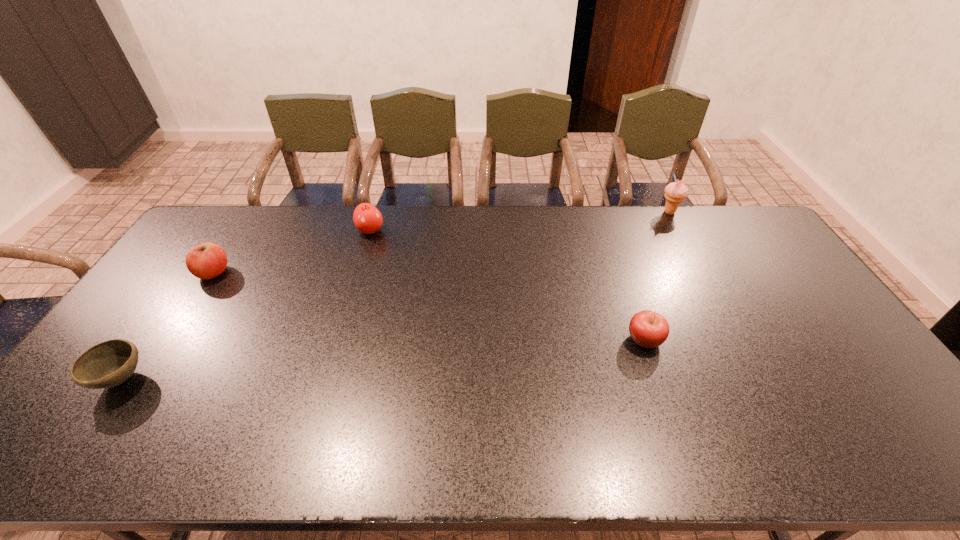
This screenshot has height=540, width=960. In order to click on the tallest object in this screenshot , I will do (676, 192).

This screenshot has width=960, height=540. I want to click on icecream, so click(676, 192).

This screenshot has height=540, width=960. Identify the location of the farthest apple. (367, 218).

Image resolution: width=960 pixels, height=540 pixels. In order to click on the third object from left to right in this screenshot , I will do `click(367, 218)`.

This screenshot has width=960, height=540. Identify the location of the third farthest object. (208, 260).

This screenshot has height=540, width=960. What are the coordinates of `the second nearest apple` in the screenshot? It's located at (208, 260).

The height and width of the screenshot is (540, 960). Identify the location of the second object from right to left. (648, 329).

This screenshot has width=960, height=540. Identify the location of the rightmost apple. (648, 329).

Identify the location of the nearest object. Image resolution: width=960 pixels, height=540 pixels. (110, 363).

Find the location of a particular element. the shortest object is located at coordinates (110, 363).